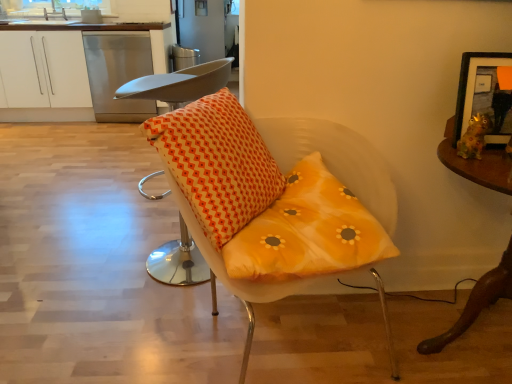
Question: From a real-world perspective, is orange fabric cushion at center, arranged as the 1th chair when viewed from the left, physically below yellow fabric cushion at center, placed as the 1th chair when sorted from right to left?

Choices:
 (A) yes
 (B) no

Answer: (B)

Question: Is orange fabric cushion at center, positioned as the second chair in right-to-left order, not near yellow fabric cushion at center, placed as the 1th chair when sorted from right to left?

Choices:
 (A) no
 (B) yes

Answer: (A)

Question: From the image's perspective, is orange fabric cushion at center, arranged as the 1th chair when viewed from the left, beneath yellow fabric cushion at center, placed as the 1th chair when sorted from right to left?

Choices:
 (A) no
 (B) yes

Answer: (A)

Question: From a real-world perspective, is orange fabric cushion at center, arranged as the 1th chair when viewed from the left, physically above yellow fabric cushion at center, placed as the 1th chair when sorted from right to left?

Choices:
 (A) no
 (B) yes

Answer: (B)

Question: Would you say orange fabric cushion at center, positioned as the second chair in right-to-left order, contains yellow fabric cushion at center, which is counted as the second chair, starting from the left?

Choices:
 (A) no
 (B) yes

Answer: (A)

Question: Is orange fabric cushion at center, positioned as the second chair in right-to-left order, positioned beyond the bounds of yellow fabric cushion at center, placed as the 1th chair when sorted from right to left?

Choices:
 (A) no
 (B) yes

Answer: (B)

Question: Is wooden framed picture at upper right facing away from white matte cabinet at upper left?

Choices:
 (A) yes
 (B) no

Answer: (B)

Question: Would you say wooden framed picture at upper right is outside white matte cabinet at upper left?

Choices:
 (A) no
 (B) yes

Answer: (B)

Question: From a real-world perspective, is wooden framed picture at upper right under white matte cabinet at upper left?

Choices:
 (A) no
 (B) yes

Answer: (A)

Question: Can you confirm if wooden framed picture at upper right is shorter than white matte cabinet at upper left?

Choices:
 (A) no
 (B) yes

Answer: (B)

Question: Is wooden framed picture at upper right taller than white matte cabinet at upper left?

Choices:
 (A) yes
 (B) no

Answer: (B)

Question: Is wooden framed picture at upper right to the right of white matte cabinet at upper left from the viewer's perspective?

Choices:
 (A) yes
 (B) no

Answer: (A)

Question: Does wooden framed picture at upper right have a lesser width compared to orange fabric cushion at center, positioned as the second chair in right-to-left order?

Choices:
 (A) yes
 (B) no

Answer: (A)